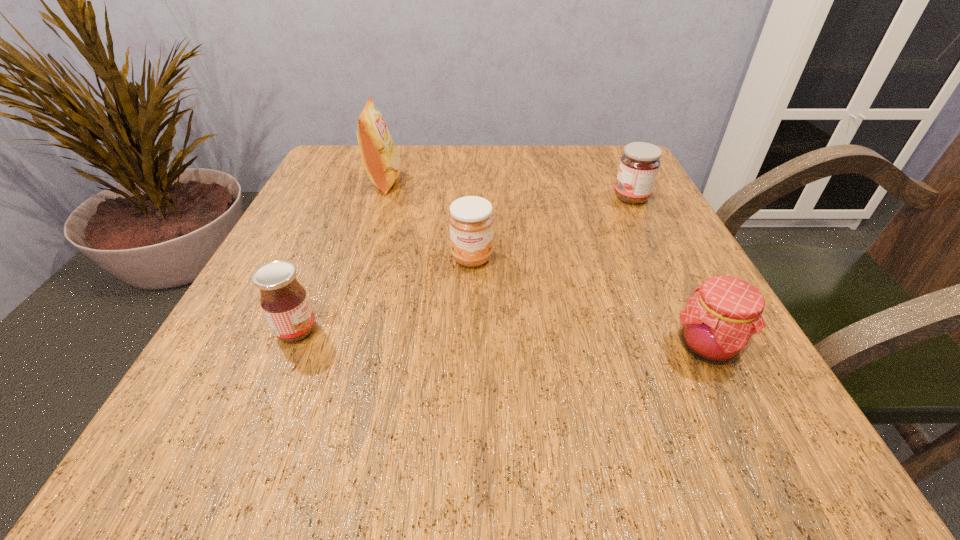
At what (x,y) coordinates should I click in order to perform the action: click on jam present at the far edge. Please return your answer as a coordinate pair (x, y). Image resolution: width=960 pixels, height=540 pixels. Looking at the image, I should click on (639, 165).

Image resolution: width=960 pixels, height=540 pixels. I want to click on crisp (potato chip) at the left edge, so click(382, 163).

At what (x,y) coordinates should I click in order to perform the action: click on jam that is at the left edge. Please return your answer as a coordinate pair (x, y). Looking at the image, I should click on (284, 301).

In order to click on object that is at the far left corner in this screenshot , I will do (x=382, y=163).

The image size is (960, 540). What are the coordinates of `object that is at the far right corner` in the screenshot? It's located at (639, 165).

You are a GUI agent. You are given a task and a screenshot of the screen. Output one action in this format:
    pyautogui.click(x=<x>, y=<y>)
    Task: Click on the free space at the far edge of the desktop
    
    Given the screenshot: What is the action you would take?
    pyautogui.click(x=547, y=191)

The height and width of the screenshot is (540, 960). What are the coordinates of `free location at the near edge of the desktop` in the screenshot? It's located at (354, 441).

This screenshot has height=540, width=960. In order to click on free point at the left edge in this screenshot , I will do `click(315, 338)`.

The width and height of the screenshot is (960, 540). In order to click on vacant space at the right edge in this screenshot , I will do `click(617, 234)`.

At what (x,y) coordinates should I click in order to perform the action: click on vacant area at the far right corner. Please return your answer as a coordinate pair (x, y). Image resolution: width=960 pixels, height=540 pixels. Looking at the image, I should click on (608, 147).